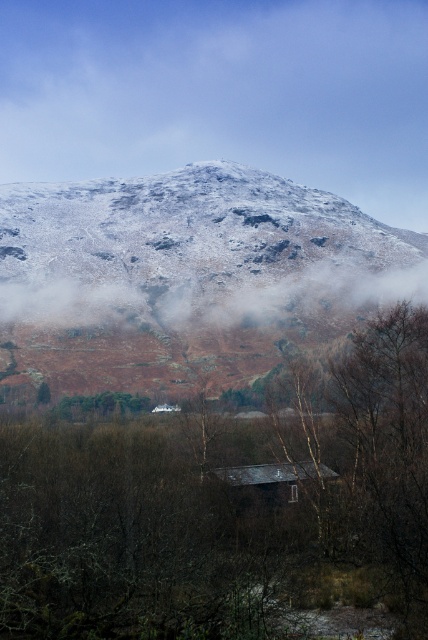
You are standing at the point labeled point (220, 92) in the image. Looking around, you see the white snow covered mountain at upper center. What direction is the white snow covered mountain at upper center relative to your current position?

The white snow covered mountain at upper center is directly in front of you because you are standing at the point labeled point (220, 92), which indicates that location points to the mountain being at upper center, meaning it is straight ahead.